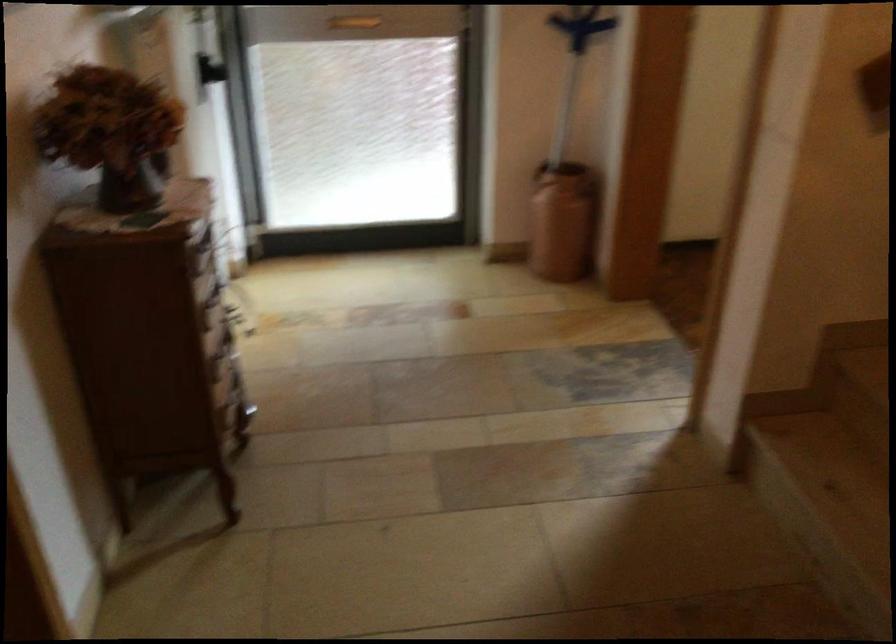
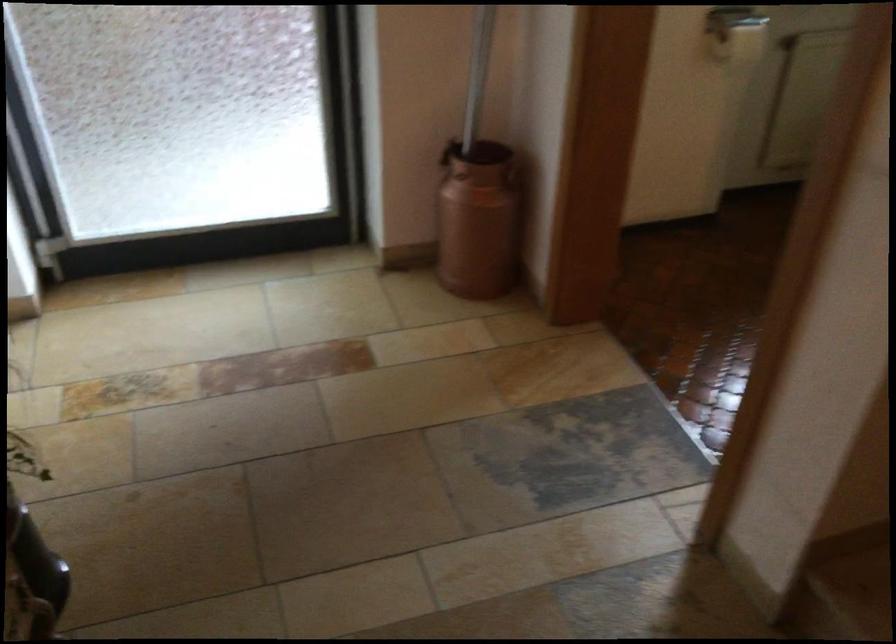
Locate, in the second image, the point that corresponds to point 560,109 in the first image.

(478, 73)